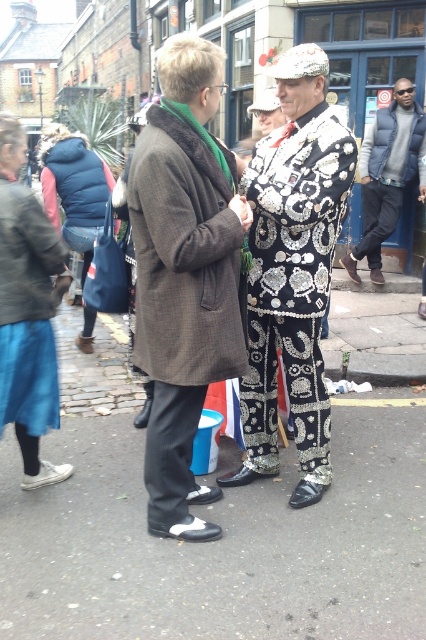
Question: Does sequined fabric suit at center have a smaller size compared to denim skirt at left?

Choices:
 (A) no
 (B) yes

Answer: (A)

Question: Is matte black jacket at right above denim jacket at left?

Choices:
 (A) no
 (B) yes

Answer: (B)

Question: Which of the following is the farthest from the observer?

Choices:
 (A) (97, 198)
 (B) (115, 570)
 (C) (0, 259)
 (D) (221, 353)

Answer: (A)

Question: Which point is closer to the camera taking this photo?

Choices:
 (A) (385, 141)
 (B) (203, 40)
 (C) (313, 384)

Answer: (B)

Question: Is black rubber shoes at lower center smaller than matte black jacket at right?

Choices:
 (A) no
 (B) yes

Answer: (A)

Question: Which point is closer to the camera?

Choices:
 (A) (325, 68)
 (B) (371, 160)
 (C) (63, 177)
 (D) (11, 212)

Answer: (D)